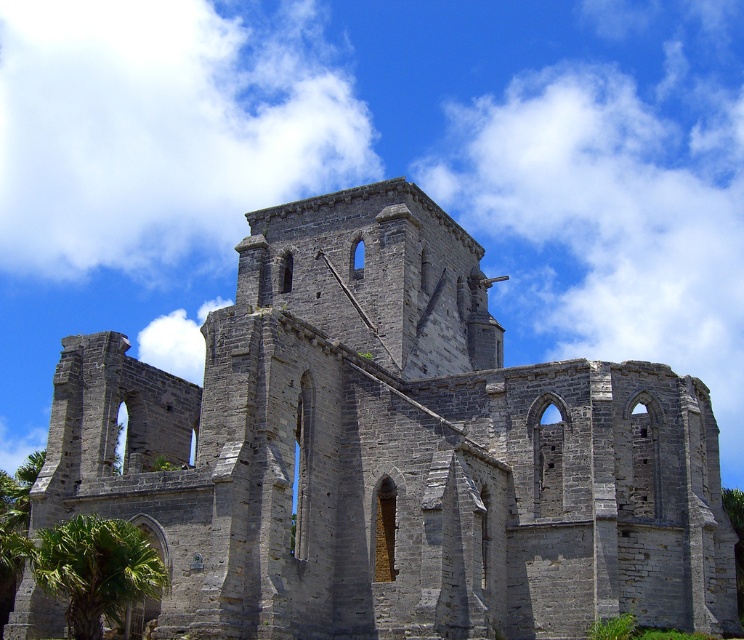
You are standing in front of the gray stone ruins at center and the green leafy palm tree at lower left. Which object is closer to the left edge of the image?

The green leafy palm tree at lower left is closer to the left edge of the image because it is positioned to the left of the gray stone ruins at center.

You are an architect assessing the stability of the gray stone ruins at center and the green leafy palm tree at lower left. Which object has a greater horizontal span when viewed from the front?

The gray stone ruins at center has a greater horizontal span than the green leafy palm tree at lower left because the gray stone ruins at center is wider.

You are standing at the entrance of the historic stone structure and notice two points marked in the scene. The first point is at coordinates point (x=638, y=452) and the second is at point (x=45, y=573). Which point is closer to your current position?

Point (x=45, y=573) is closer to your current position because it is in front of point (x=638, y=452), which is behind it.